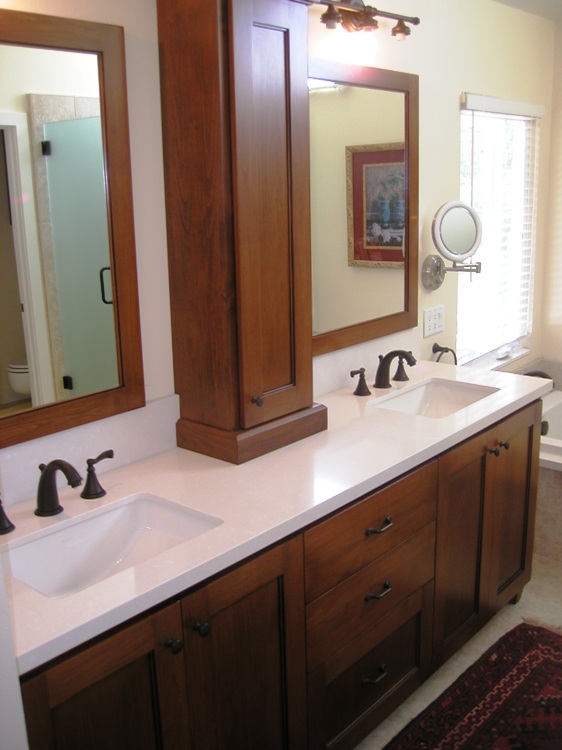
This screenshot has width=562, height=750. In order to click on sink in this screenshot , I will do `click(108, 558)`, `click(429, 394)`.